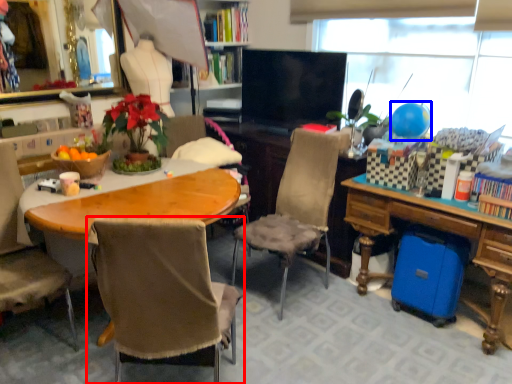
Question: Which point is further to the camera, chair (highlighted by a red box) or balloon (highlighted by a blue box)?

Choices:
 (A) chair
 (B) balloon

Answer: (B)